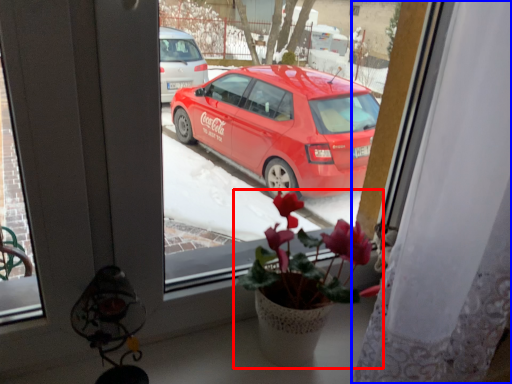
Question: Which of the following is the closest to the observer, houseplant (highlighted by a red box) or curtain (highlighted by a blue box)?

Choices:
 (A) houseplant
 (B) curtain

Answer: (B)